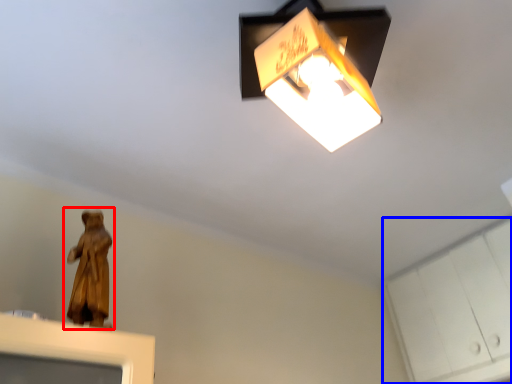
Question: Which object is closer to the camera taking this photo, person (highlighted by a red box) or cabinetry (highlighted by a blue box)?

Choices:
 (A) person
 (B) cabinetry

Answer: (A)